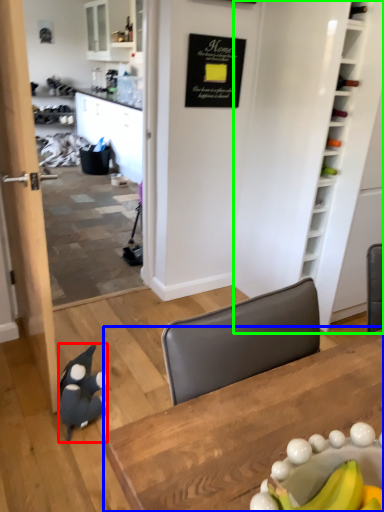
Question: Based on their relative distances, which object is farther from penguin (highlighted by a red box)? Choose from table (highlighted by a blue box) and bookshelf (highlighted by a green box).

Choices:
 (A) table
 (B) bookshelf

Answer: (B)